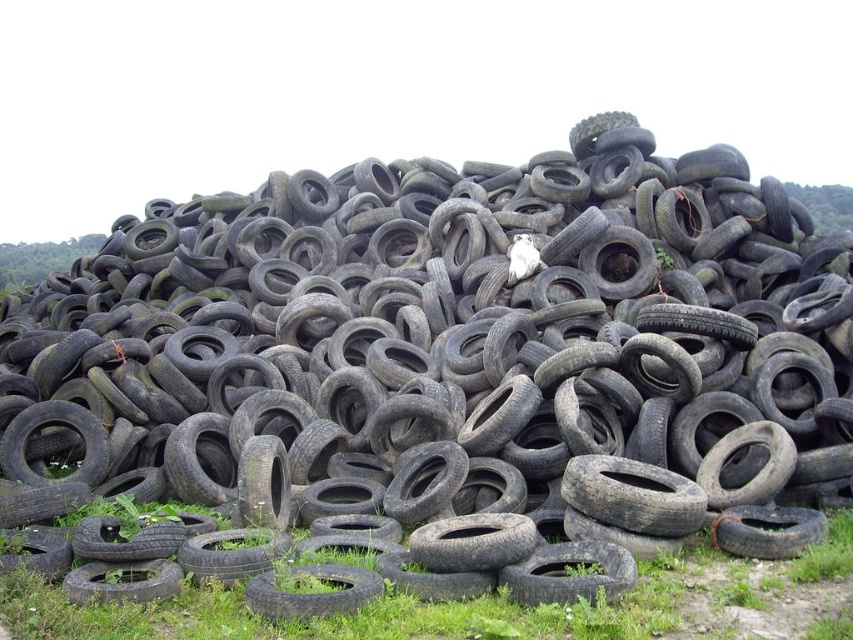
Does black rubber tire at lower center have a larger size compared to black rubber tire at center?

Incorrect, black rubber tire at lower center is not larger than black rubber tire at center.

Where is `black rubber tire at lower center`? The width and height of the screenshot is (853, 640). black rubber tire at lower center is located at coordinates (312, 593).

Identify the location of black rubber tire at lower center. The width and height of the screenshot is (853, 640). (312, 593).

Does green grass at lower center have a greater height compared to black rubber tire at lower center?

Yes.

Which is more to the left, green grass at lower center or black rubber tire at lower center?

From the viewer's perspective, black rubber tire at lower center appears more on the left side.

Who is more distant from viewer, [343,618] or [370,595]?

The point [370,595] is behind.

Identify the location of green grass at lower center. This screenshot has width=853, height=640. (437, 604).

Can you confirm if green grass at lower center is wider than black rubber tire at center?

Yes.

Which is above, green grass at lower center or black rubber tire at center?

Positioned higher is black rubber tire at center.

Is point (607, 612) less distant than point (732, 515)?

Yes, point (607, 612) is closer to viewer.

The width and height of the screenshot is (853, 640). Identify the location of green grass at lower center. pos(437,604).